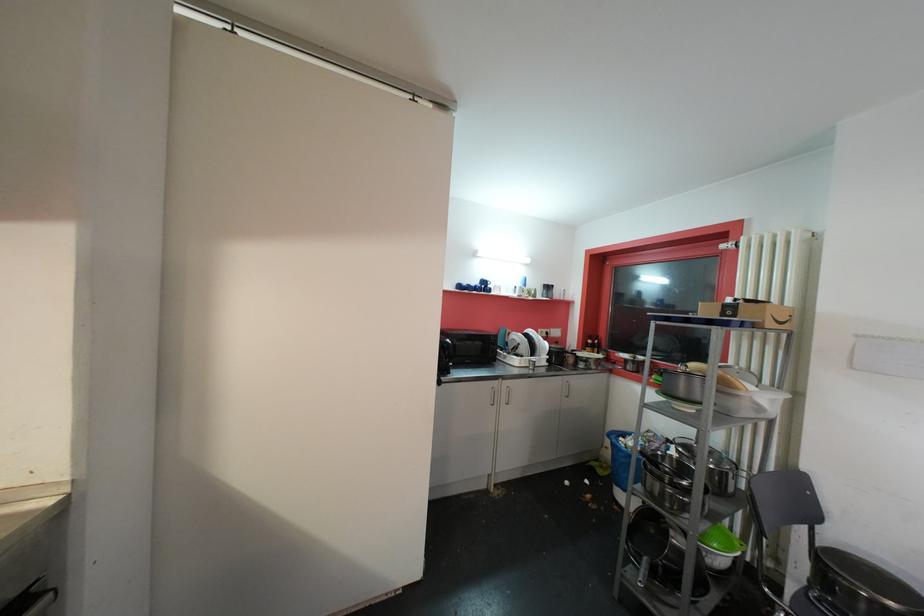
The location [622,460] corresponds to which object?

This point indicates the blue plastic bin.